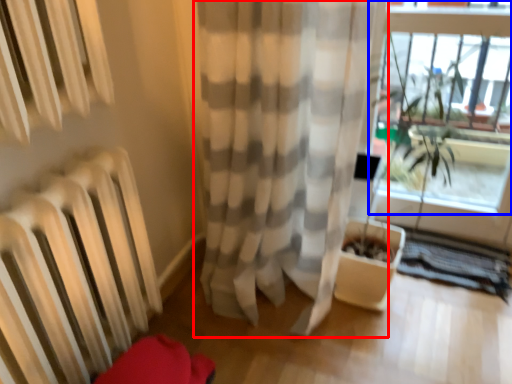
Question: Which point is closer to the camera, curtain (highlighted by a red box) or window frame (highlighted by a blue box)?

Choices:
 (A) curtain
 (B) window frame

Answer: (A)